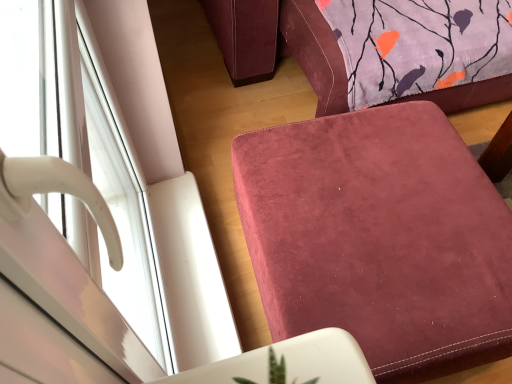
The image size is (512, 384). What do you see at coordinates (77, 292) in the screenshot?
I see `white glossy window handle at left` at bounding box center [77, 292].

Find the location of a particular element. The image size is (512, 384). white glossy window handle at left is located at coordinates (77, 292).

Based on the photo, what is the approximate height of white glossy window handle at left?

white glossy window handle at left is 1.12 meters tall.

What do you see at coordinates (379, 238) in the screenshot?
I see `suede-like burgundy ottoman at lower right` at bounding box center [379, 238].

You are a GUI agent. You are given a task and a screenshot of the screen. Output one action in this format:
    pyautogui.click(x=<x>, y=<y>)
    Task: Click on the suede-like burgundy ottoman at lower right
    
    Given the screenshot: What is the action you would take?
    pyautogui.click(x=379, y=238)

What are the coordinates of `white glossy window handle at left` in the screenshot? It's located at (77, 292).

Is suede-like burgundy ottoman at lower right to the left of white glossy window handle at left from the viewer's perspective?

In fact, suede-like burgundy ottoman at lower right is to the right of white glossy window handle at left.

Which object is further away from the camera taking this photo, suede-like burgundy ottoman at lower right or white glossy window handle at left?

suede-like burgundy ottoman at lower right is behind.

Does point (301, 251) come behind point (74, 53)?

Yes.

From the image's perspective, is suede-like burgundy ottoman at lower right positioned above or below white glossy window handle at left?

Clearly, from the image's perspective, suede-like burgundy ottoman at lower right is below white glossy window handle at left.

From a real-world perspective, does suede-like burgundy ottoman at lower right stand above white glossy window handle at left?

No, from a real-world perspective, suede-like burgundy ottoman at lower right is not over white glossy window handle at left

Is suede-like burgundy ottoman at lower right thinner than white glossy window handle at left?

No.

Who is taller, suede-like burgundy ottoman at lower right or white glossy window handle at left?

white glossy window handle at left is taller.

Which of these two, suede-like burgundy ottoman at lower right or white glossy window handle at left, is smaller?

Smaller between the two is white glossy window handle at left.

Is suede-like burgundy ottoman at lower right inside the boundaries of white glossy window handle at left, or outside?

suede-like burgundy ottoman at lower right is not inside white glossy window handle at left, it's outside.

Are suede-like burgundy ottoman at lower right and white glossy window handle at left beside each other?

No, suede-like burgundy ottoman at lower right is not touching white glossy window handle at left.

Is suede-like burgundy ottoman at lower right turned away from white glossy window handle at left?

Yes, suede-like burgundy ottoman at lower right's orientation is away from white glossy window handle at left.

Where is `furniture directly beneath the white glossy window handle at left (from a real-world perspective)`? furniture directly beneath the white glossy window handle at left (from a real-world perspective) is located at coordinates (379, 238).

Between white glossy window handle at left and suede-like burgundy ottoman at lower right, which one appears on the right side from the viewer's perspective?

suede-like burgundy ottoman at lower right.

Who is more distant, white glossy window handle at left or suede-like burgundy ottoman at lower right?

suede-like burgundy ottoman at lower right is behind.

Is point (127, 370) positioned behind point (472, 281)?

No.

From the image's perspective, which one is positioned higher, white glossy window handle at left or suede-like burgundy ottoman at lower right?

white glossy window handle at left appears higher in the image.

From a real-world perspective, is white glossy window handle at left positioned above or below suede-like burgundy ottoman at lower right?

white glossy window handle at left is above suede-like burgundy ottoman at lower right.

Looking at their sizes, would you say white glossy window handle at left is wider or thinner than suede-like burgundy ottoman at lower right?

white glossy window handle at left is thinner than suede-like burgundy ottoman at lower right.

Does white glossy window handle at left have a greater height compared to suede-like burgundy ottoman at lower right?

Yes.

Can you confirm if white glossy window handle at left is bigger than suede-like burgundy ottoman at lower right?

Incorrect, white glossy window handle at left is not larger than suede-like burgundy ottoman at lower right.

Is white glossy window handle at left not within suede-like burgundy ottoman at lower right?

Yes, white glossy window handle at left is outside of suede-like burgundy ottoman at lower right.

Can you see white glossy window handle at left touching suede-like burgundy ottoman at lower right?

No, white glossy window handle at left is not beside suede-like burgundy ottoman at lower right.

From the picture: Is white glossy window handle at left looking in the opposite direction of suede-like burgundy ottoman at lower right?

No, white glossy window handle at left is not facing the opposite direction of suede-like burgundy ottoman at lower right.

Can you tell me how much white glossy window handle at left and suede-like burgundy ottoman at lower right differ in facing direction?

The angle between the facing direction of white glossy window handle at left and the facing direction of suede-like burgundy ottoman at lower right is 1.51 degrees.

Could you measure the distance between white glossy window handle at left and suede-like burgundy ottoman at lower right?

They are 65.66 centimeters apart.

Locate an element on the screen. The height and width of the screenshot is (384, 512). window in front of the suede-like burgundy ottoman at lower right is located at coordinates (77, 292).

The image size is (512, 384). Identify the location of window above the suede-like burgundy ottoman at lower right (from the image's perspective). (77, 292).

Identify the location of furniture that is under the white glossy window handle at left (from a real-world perspective). The image size is (512, 384). (379, 238).